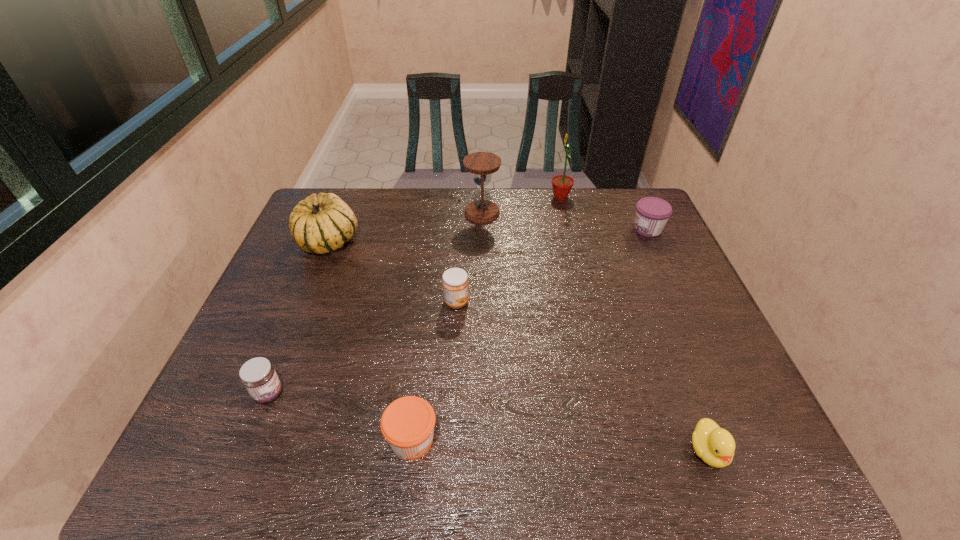
Identify the location of jam identified as the third closest to the seventh shortest object. Image resolution: width=960 pixels, height=540 pixels. (407, 424).

Locate which jam is the third closest to the second tallest object. Please provide its 2D coordinates. Your answer should be formatted as a tuple, i.e. [(x, y)], where the tuple contains the x and y coordinates of a point satisfying the conditions above.

[(407, 424)]